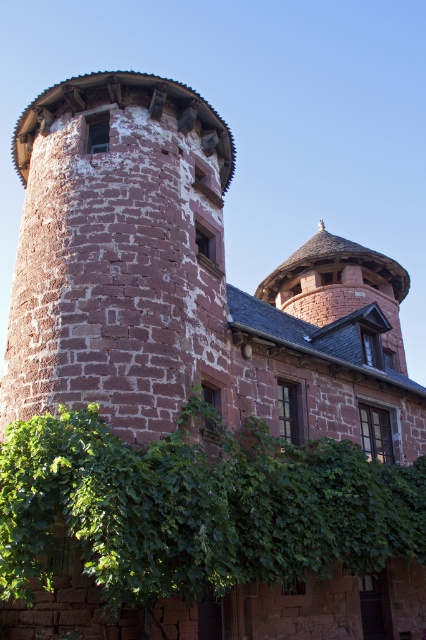
Question: Considering the relative positions of brown stone tower at left and green leafy ivy at lower center in the image provided, where is brown stone tower at left located with respect to green leafy ivy at lower center?

Choices:
 (A) above
 (B) below

Answer: (A)

Question: From the image, what is the correct spatial relationship of brown stone tower at left in relation to green leafy ivy at lower center?

Choices:
 (A) above
 (B) below

Answer: (A)

Question: Does brown stone tower at left have a smaller size compared to green leafy ivy at lower center?

Choices:
 (A) yes
 (B) no

Answer: (B)

Question: Which point appears closest to the camera in this image?

Choices:
 (A) (140, 280)
 (B) (400, 524)

Answer: (A)

Question: Among these objects, which one is nearest to the camera?

Choices:
 (A) brown stone tower at left
 (B) green leafy ivy at lower center

Answer: (B)